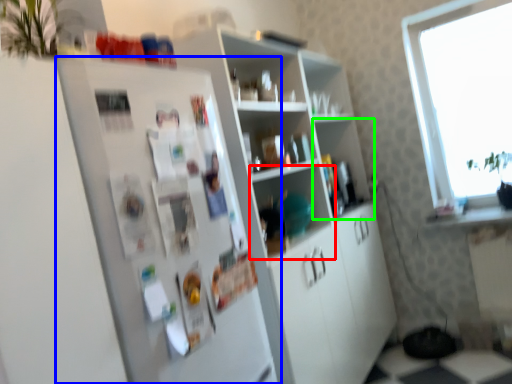
Question: Based on their relative distances, which object is farther from shelf (highlighted by a red box)? Choose from fridge (highlighted by a blue box) and shelf (highlighted by a green box).

Choices:
 (A) fridge
 (B) shelf

Answer: (A)